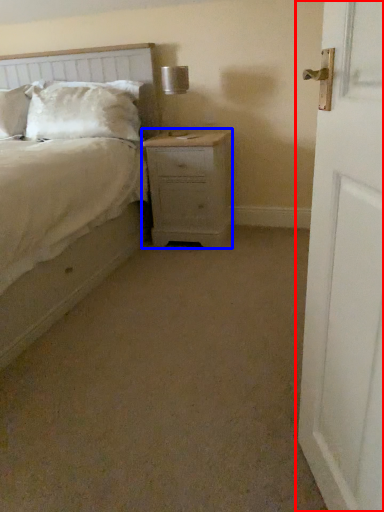
Question: Among these objects, which one is nearest to the camera, door (highlighted by a red box) or nightstand (highlighted by a blue box)?

Choices:
 (A) door
 (B) nightstand

Answer: (A)